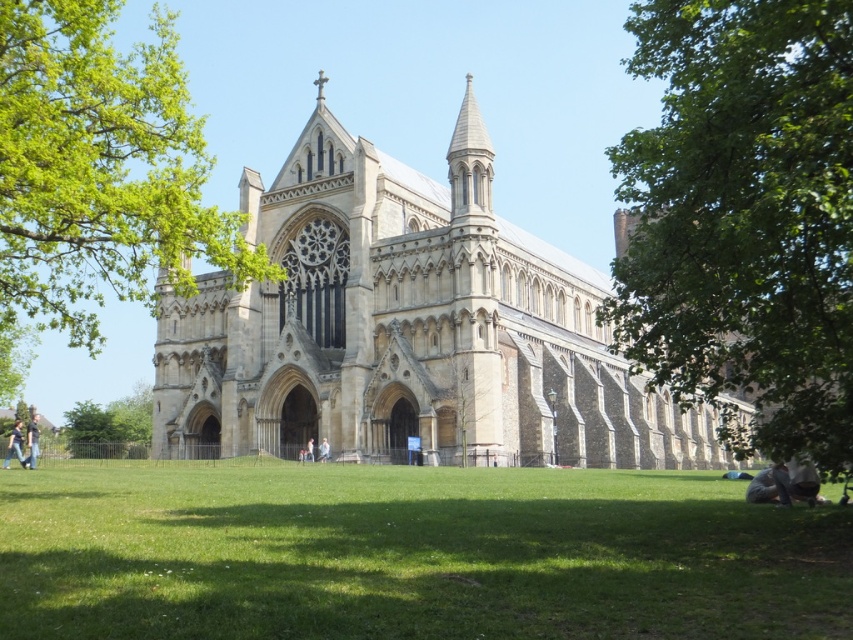
You are standing in front of the cathedral and notice two points marked on the image. The first point is located at coordinate point (236, 452) and the second at point (788, 483). Which point is closer to you as you face the cathedral?

Point (788, 483) is closer to you because it is in front of point (236, 452).

You are a tourist standing in front of the cathedral and want to take a photo of the light blue jeans at lower left and the green leafy tree at lower left. Which object is closer to you?

The green leafy tree at lower left is closer to you because the light blue jeans at lower left is behind it.